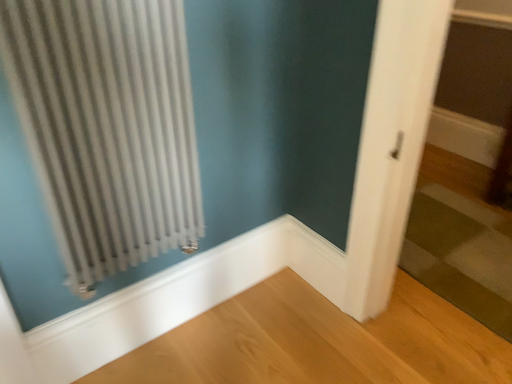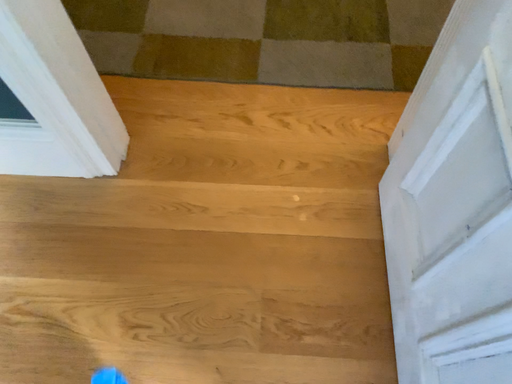
Question: Which way did the camera rotate in the video?

Choices:
 (A) rotated upward
 (B) rotated downward

Answer: (B)